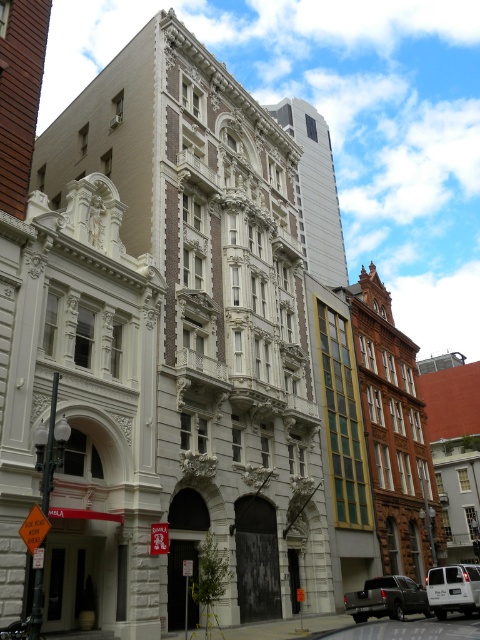
Question: Among these points, which one is nearest to the camera?

Choices:
 (A) (434, 576)
 (B) (393, 584)

Answer: (A)

Question: Which point is farther to the camera?

Choices:
 (A) white matte van at center
 (B) metallic gray truck at center

Answer: (B)

Question: Is metallic gray truck at center above white matte van at center?

Choices:
 (A) yes
 (B) no

Answer: (A)

Question: Is metallic gray truck at center above white matte van at center?

Choices:
 (A) no
 (B) yes

Answer: (B)

Question: Which point appears farthest from the camera in this image?

Choices:
 (A) (457, 580)
 (B) (419, 611)

Answer: (B)

Question: Does metallic gray truck at center appear on the left side of white matte van at center?

Choices:
 (A) yes
 (B) no

Answer: (A)